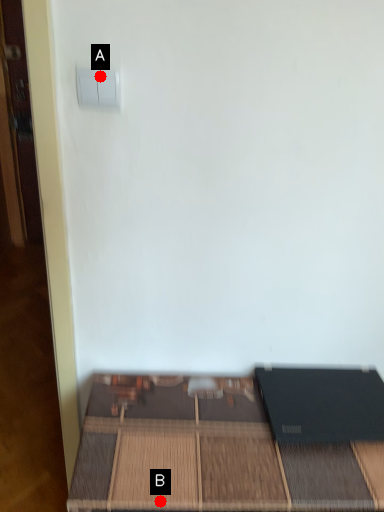
Question: Two points are circled on the image, labeled by A and B beside each circle. Among these points, which one is farthest from the camera?

Choices:
 (A) A is further
 (B) B is further

Answer: (B)